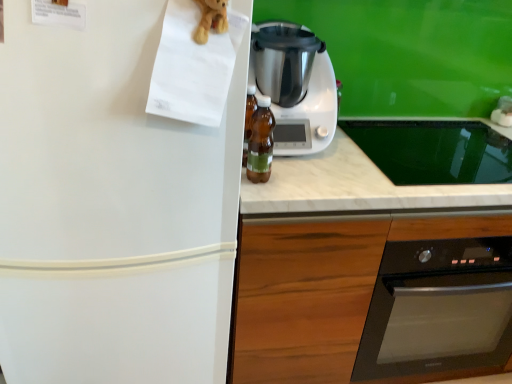
This screenshot has width=512, height=384. I want to click on vacant region to the right of translucent amber bottle at center, so tap(312, 181).